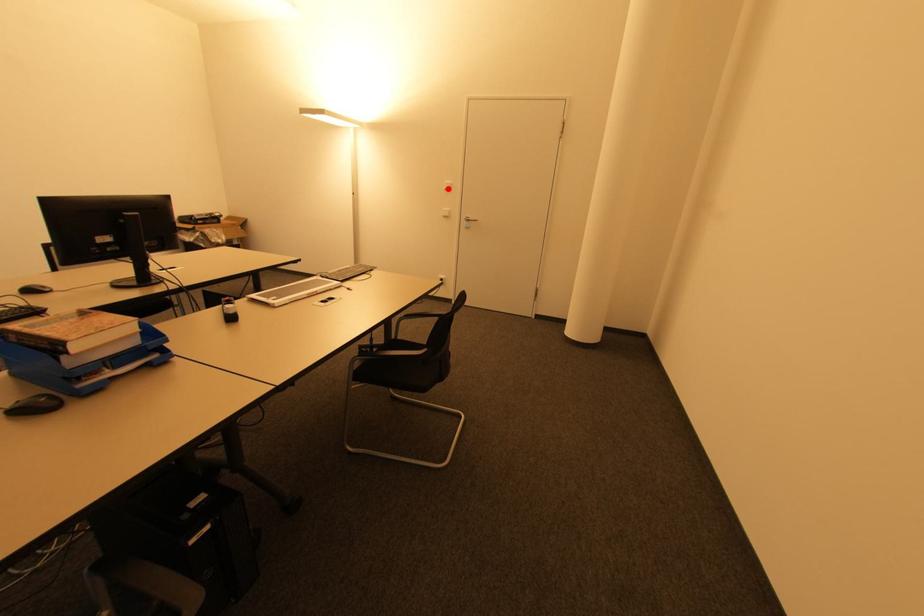
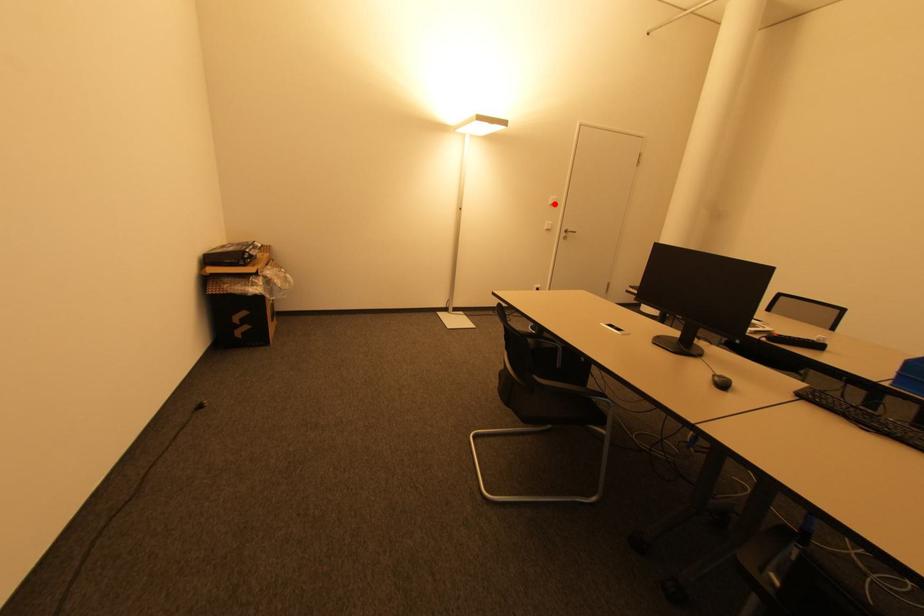
I am providing you with two images of the same scene from different viewpoints. A red point is marked on the first image and another point is marked on the second image. Is the red point in image1 aligned with the point shown in image2?

Yes